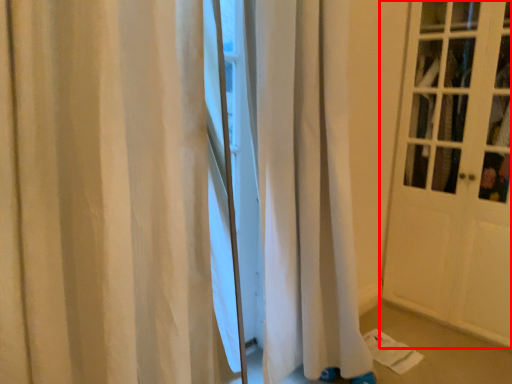
Question: Where is door (annotated by the red box) located in relation to curtain in the image?

Choices:
 (A) right
 (B) left

Answer: (A)